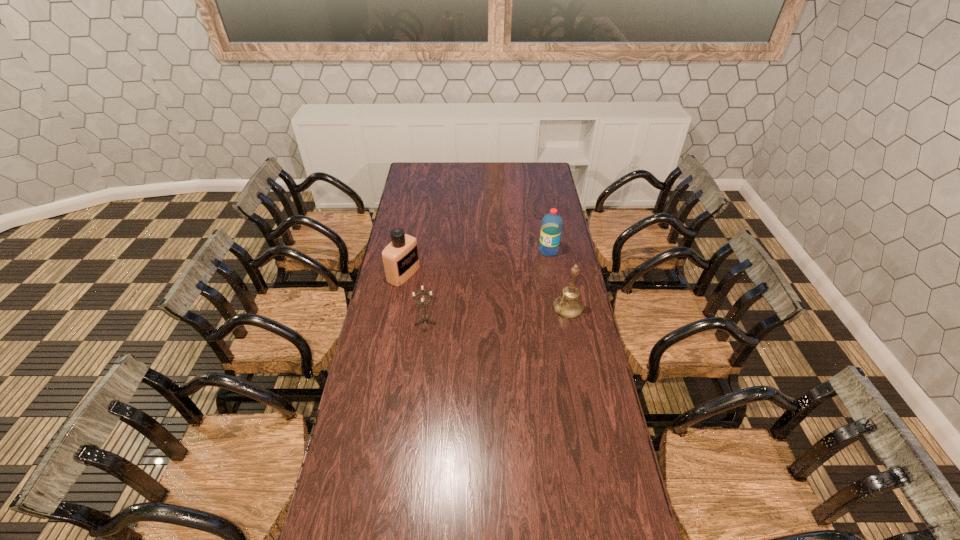
Locate an element on the screen. the third closest object relative to the water bottle is located at coordinates (425, 317).

This screenshot has width=960, height=540. I want to click on object that ranks as the second closest to the shortest object, so click(x=568, y=305).

I want to click on vacant space that satisfies the following two spatial constraints: 1. on the back side of the shortest object; 2. on the right side of the farthest object, so click(434, 251).

Where is `vacant space that satisfies the following two spatial constraints: 1. on the back side of the farthest object; 2. on the left side of the leftmost object`? The height and width of the screenshot is (540, 960). vacant space that satisfies the following two spatial constraints: 1. on the back side of the farthest object; 2. on the left side of the leftmost object is located at coordinates tap(408, 251).

The image size is (960, 540). Find the location of `blank area in the image that satisfies the following two spatial constraints: 1. on the front side of the perfume; 2. on the left side of the candle holder`. blank area in the image that satisfies the following two spatial constraints: 1. on the front side of the perfume; 2. on the left side of the candle holder is located at coordinates (395, 321).